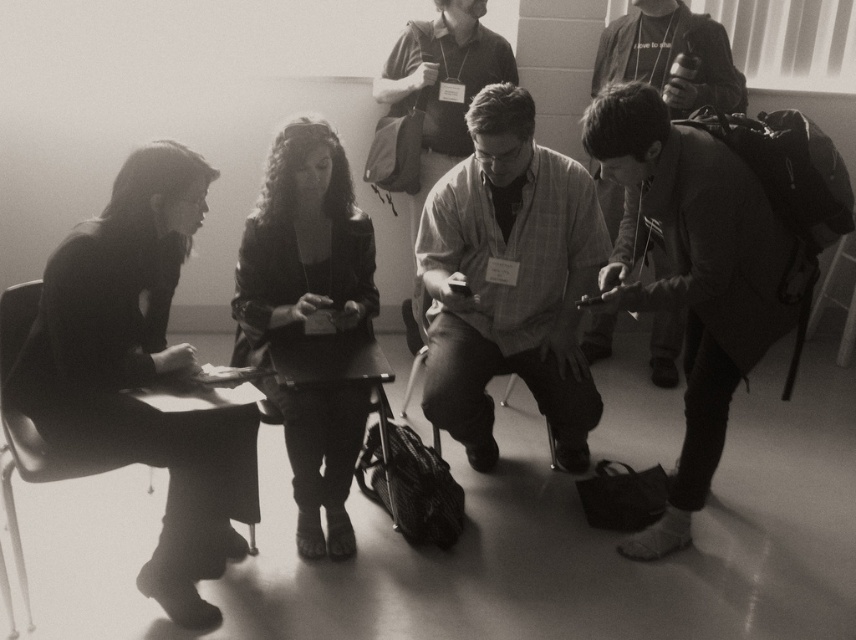
Question: Is coarse fabric jacket at right positioned behind denim jacket at center?

Choices:
 (A) yes
 (B) no

Answer: (B)

Question: Which of these objects is positioned farthest from the coarse fabric jacket at right?

Choices:
 (A) metallic gray chair at center
 (B) matte gray jacket at lower right

Answer: (B)

Question: Does metallic black chair at left come behind metallic gray chair at center?

Choices:
 (A) no
 (B) yes

Answer: (A)

Question: Does plaid shirt at center have a lesser width compared to metallic gray chair at center?

Choices:
 (A) no
 (B) yes

Answer: (A)

Question: Among these points, which one is nearest to the camera?

Choices:
 (A) (402, 410)
 (B) (720, 385)
 (C) (74, 401)
 (D) (70, 476)

Answer: (D)

Question: Considering the real-world distances, which object is farthest from the smooth black dress at left?

Choices:
 (A) plaid shirt at center
 (B) matte gray jacket at lower right

Answer: (B)